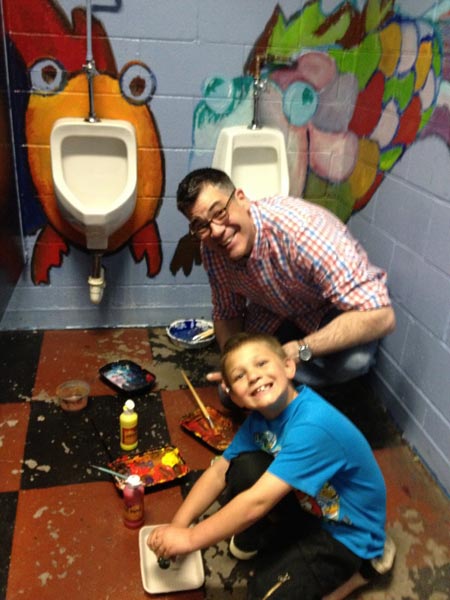
You are a GUI agent. You are given a task and a screenshot of the screen. Output one action in this format:
    pyautogui.click(x=<x>, y=<y>)
    Task: Click on the floor
    The width and height of the screenshot is (450, 600).
    Given the screenshot: What is the action you would take?
    pyautogui.click(x=73, y=528)